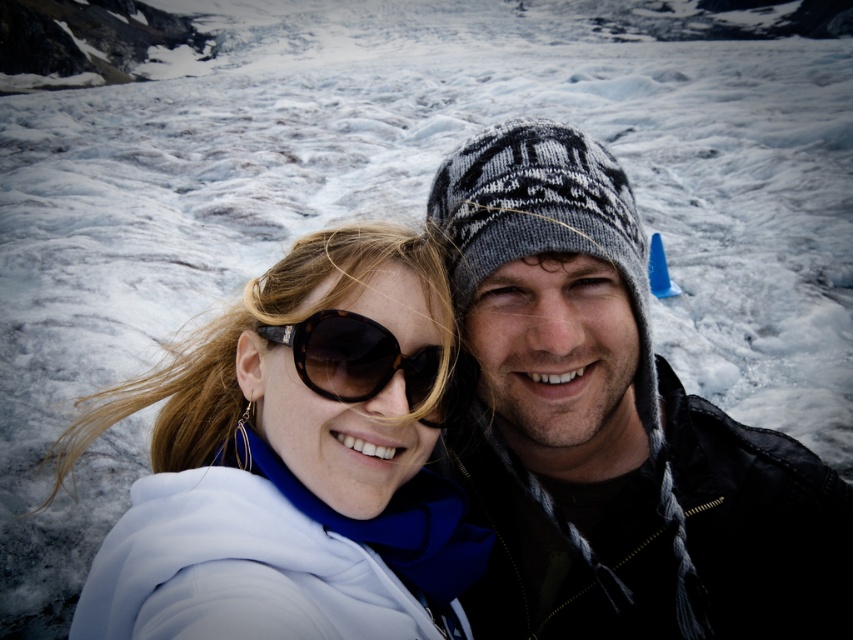
Does knitted wool hat at upper right appear over black tortoiseshell sunglasses at center?

Actually, knitted wool hat at upper right is below black tortoiseshell sunglasses at center.

Does knitted wool hat at upper right appear on the left side of black tortoiseshell sunglasses at center?

Incorrect, knitted wool hat at upper right is not on the left side of black tortoiseshell sunglasses at center.

Find the location of a particular element. The height and width of the screenshot is (640, 853). knitted wool hat at upper right is located at coordinates (612, 426).

Locate an element on the screen. The image size is (853, 640). white fabric at center is located at coordinates [x=294, y=461].

Does point (181, 371) come closer to viewer compared to point (434, 416)?

No, it is behind (434, 416).

What are the coordinates of `white fabric at center` in the screenshot? It's located at (294, 461).

Consider the image. Does knitted wool hat at upper right lie behind white fabric at center?

Yes, it is behind white fabric at center.

Does knitted wool hat at upper right have a greater width compared to white fabric at center?

In fact, knitted wool hat at upper right might be narrower than white fabric at center.

Which is behind, point (473, 317) or point (218, 480)?

Positioned behind is point (473, 317).

What are the coordinates of `knitted wool hat at upper right` in the screenshot? It's located at (612, 426).